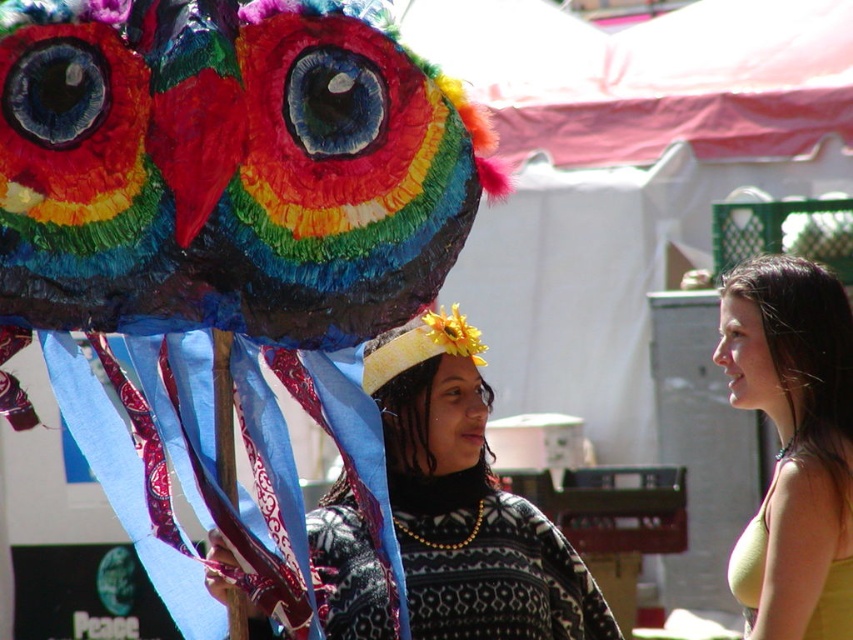
You are at a party and see two people wearing the patterned sweater at center and the yellow fabric top at center. Which clothing item is lower on their body?

The patterned sweater at center is positioned under the yellow fabric top at center, so the sweater is lower on their body than the top.

You are a photographer trying to capture a photo of the multicolored paper mache owl at left and the patterned sweater at center. Since you want both subjects to be clearly visible, which object should you focus on first to ensure proper depth of field?

The multicolored paper mache owl at left should be focused on first because it is closer to the camera than the patterned sweater at center, ensuring both will be in focus when using proper depth of field techniques.

You are a photographer trying to capture a clear photo of the multicolored paper mache owl at left and the yellow fabric top at center. Which object is blocking the view of the other?

The multicolored paper mache owl at left is blocking the view of the yellow fabric top at center because it is positioned over it.